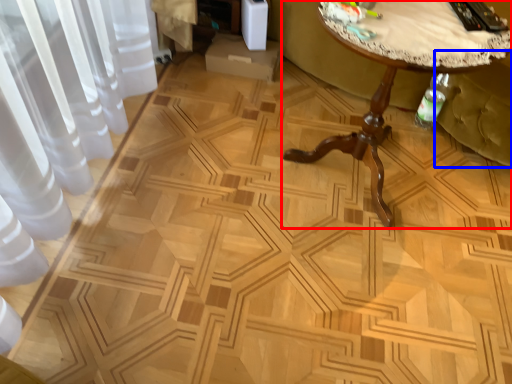
Question: Which object is further to the camera taking this photo, table (highlighted by a red box) or swivel chair (highlighted by a blue box)?

Choices:
 (A) table
 (B) swivel chair

Answer: (B)